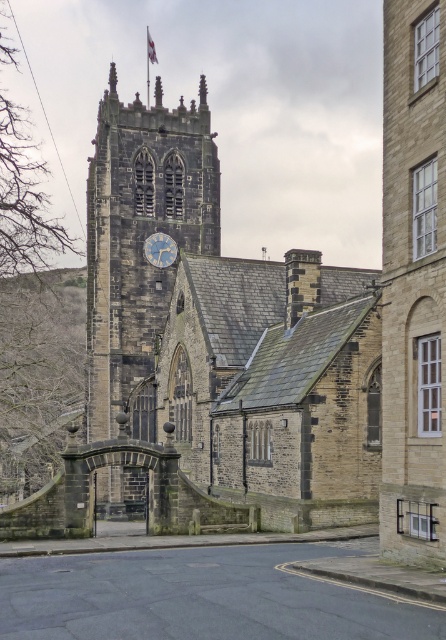
Question: Among these objects, which one is nearest to the camera?

Choices:
 (A) stone clock tower at center
 (B) blue painted metal clock at center

Answer: (A)

Question: Observing the image, what is the correct spatial positioning of stone clock tower at center in reference to blue painted metal clock at center?

Choices:
 (A) right
 (B) left

Answer: (B)

Question: Where is stone clock tower at center located in relation to blue painted metal clock at center in the image?

Choices:
 (A) right
 (B) left

Answer: (B)

Question: Which object is farther from the camera taking this photo?

Choices:
 (A) blue painted metal clock at center
 (B) stone clock tower at center

Answer: (A)

Question: Can you confirm if stone clock tower at center is positioned below blue painted metal clock at center?

Choices:
 (A) yes
 (B) no

Answer: (A)